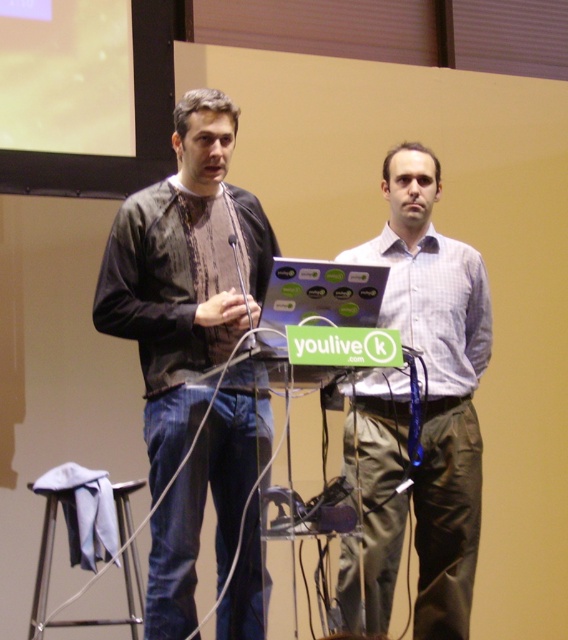
You are an event planner setting up a camera to capture both the person on the left and the person on the right during their presentation. The camera is positioned to focus on the white checkered shirt at center. Based on the coordinates provided in the description, will the camera capture both individuals equally well?

The white checkered shirt at center is located at point (436, 380), which is near the center of the image. Since both individuals are positioned around this central area, the camera focused on the white checkered shirt at center should capture both individuals equally well.

You are organizing a presentation and need to place a name tag on the podium. The name tag is 15 cm tall. The dark brown leather jacket at left and the metallic silver stool at lower left are in the way. Which object is closer to the podium so you can move it first?

The dark brown leather jacket at left is located above the metallic silver stool at lower left, so the metallic silver stool at lower left is closer to the podium. Move it first to make space.

You are a photographer taking a photo of the stage setup. You notice two points marked in the scene. Which point, point (444, 376) or point (82, 29), is closer to your camera lens?

Point (444, 376) is closer to the camera lens than point (82, 29).